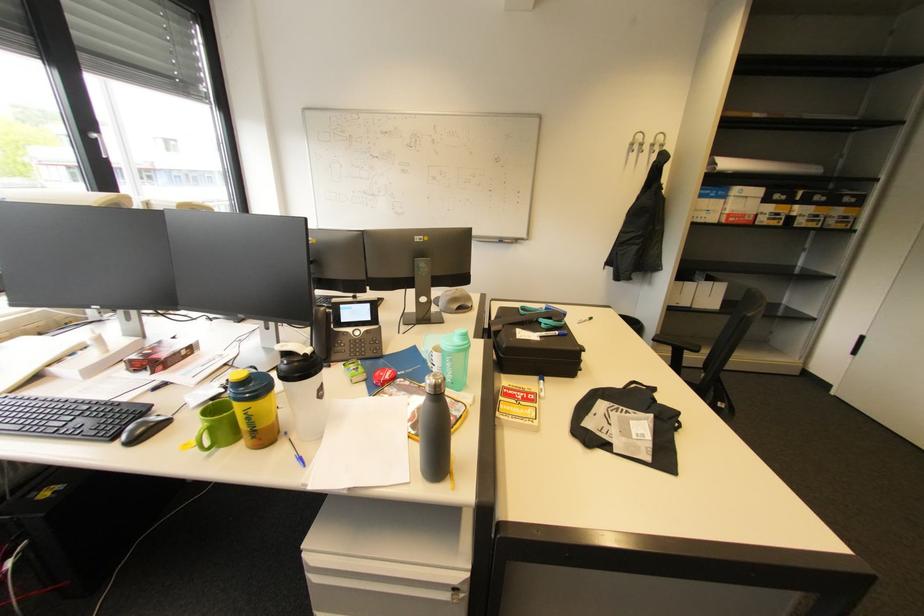
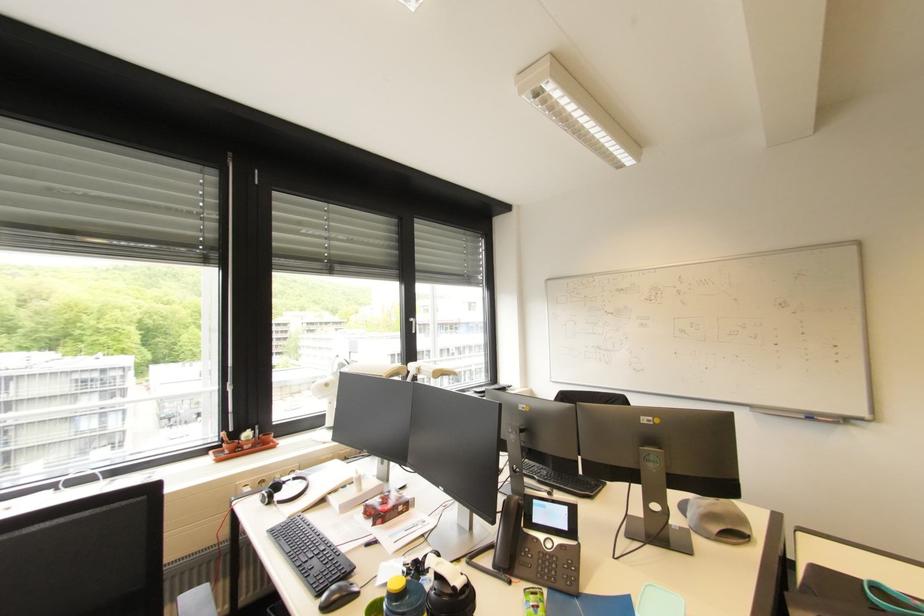
Find the pixel in the second image that matches pixel 287 360 in the first image.

(441, 583)